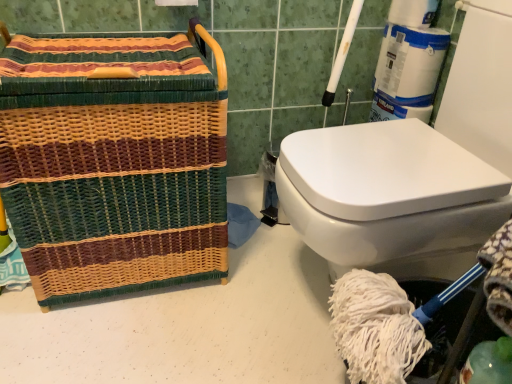
In order to click on vacant space to the right of woven multicolored basket at left in this screenshot , I will do `click(253, 286)`.